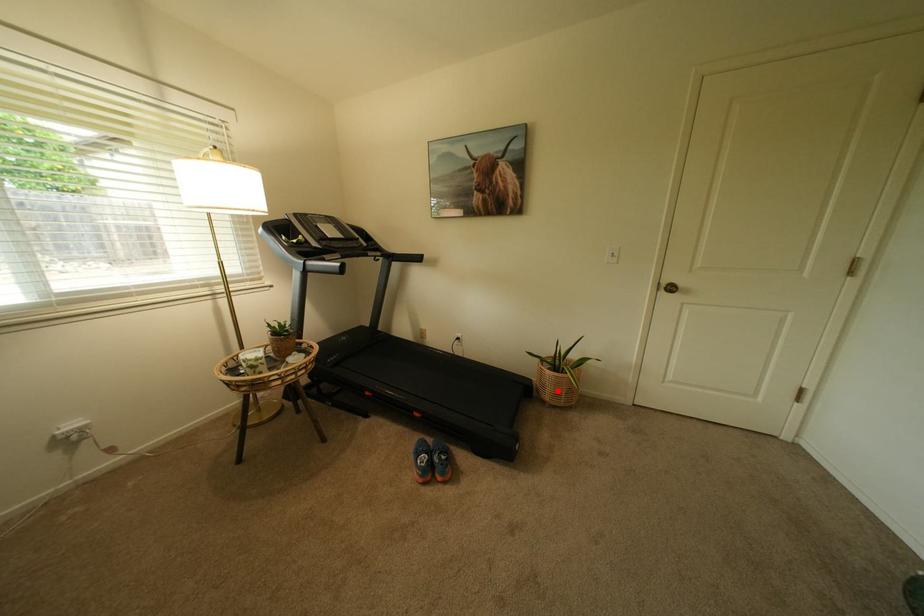
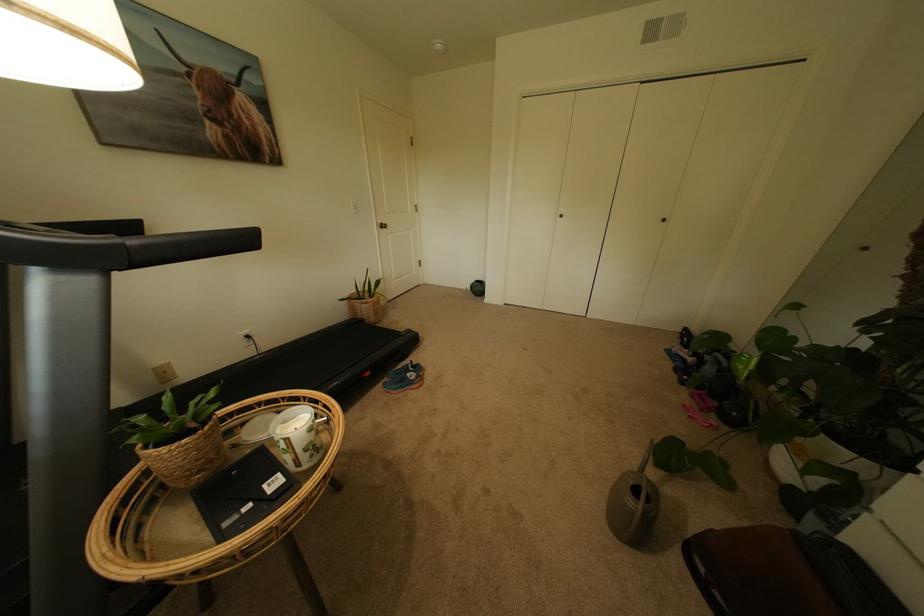
The point at the highlighted location is marked in the first image. Where is the corresponding point in the second image?

(382, 314)